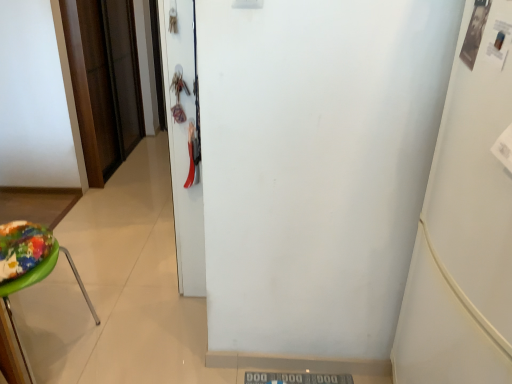
Question: From a real-world perspective, is brown wood door at left, which is the second door in right-to-left order, above or below green plastic stool at left?

Choices:
 (A) below
 (B) above

Answer: (B)

Question: Considering the positions of brown wood door at left, which appears as the 1th door when viewed from the back, and green plastic stool at left in the image, is brown wood door at left, which appears as the 1th door when viewed from the back, bigger or smaller than green plastic stool at left?

Choices:
 (A) big
 (B) small

Answer: (B)

Question: Estimate the real-world distances between objects in this image. Which object is farther from the green plastic stool at left?

Choices:
 (A) brown wood door at left, acting as the second door starting from the front
 (B) white glossy door at center, the 1th door in the front-to-back sequence
 (C) white matte refrigerator at right

Answer: (A)

Question: Which object is the closest to the brown wood door at left, marked as the first door in a left-to-right arrangement?

Choices:
 (A) white matte refrigerator at right
 (B) green plastic stool at left
 (C) white glossy door at center, which appears as the 2th door when viewed from the left

Answer: (C)